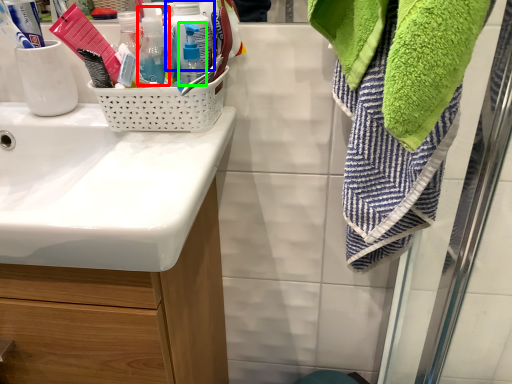
Question: Which object is the closest to the bottle (highlighted by a red box)? Choose among these: bottle (highlighted by a blue box) or bottle (highlighted by a green box).

Choices:
 (A) bottle
 (B) bottle

Answer: (A)